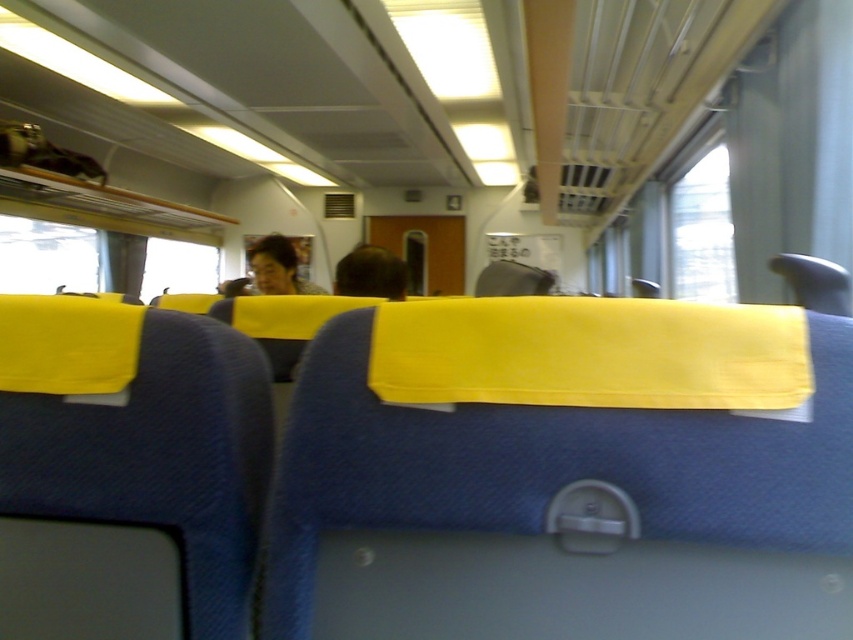
You are a passenger sitting in the train carriage and notice two people standing in front of you. One has brown hair at center and the other has matte black hair at center. Which person is standing closer to the ceiling?

The matte black hair at center is closer to the ceiling because the brown hair at center is located below it.

You are a passenger sitting in the train carriage and want to take a photo of both the point at coordinates (386, 268) and the point at coordinates (291, 257). Which point should you focus on first to ensure both are in clear view?

You should focus on point (291, 257) first because it is farther from the camera than point (386, 268). By focusing on the farther point, both points will be in clear view.